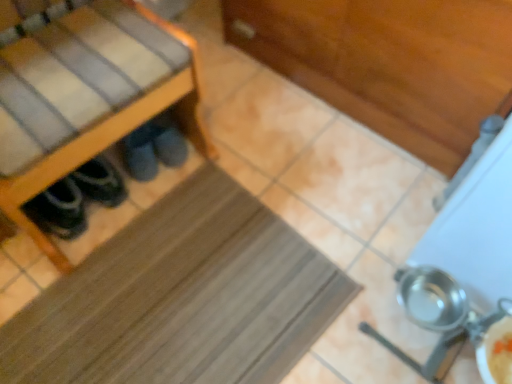
Question: Looking at the image, does wooden shoe rack at left seem bigger or smaller compared to brown rubber mat at center?

Choices:
 (A) small
 (B) big

Answer: (B)

Question: Relative to brown rubber mat at center, is wooden shoe rack at left in front or behind?

Choices:
 (A) front
 (B) behind

Answer: (A)

Question: Which object is the farthest from the metallic silver pot at lower right?

Choices:
 (A) wooden shoe rack at left
 (B) dark gray suede slippers at lower left
 (C) brown rubber mat at center

Answer: (B)

Question: Which of these objects is positioned closest to the brown rubber mat at center?

Choices:
 (A) wooden shoe rack at left
 (B) dark gray suede slippers at lower left
 (C) metallic silver pot at lower right

Answer: (A)